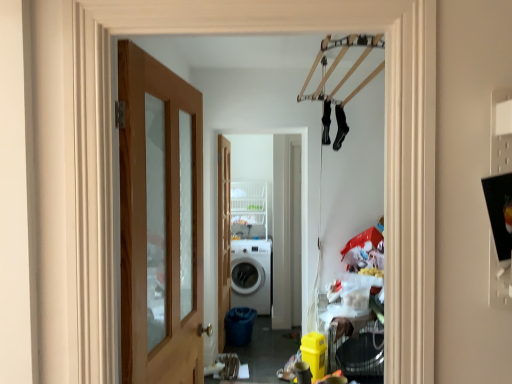
Question: Is white matte washing machine at center in front of wooden door at center, arranged as the 1th door when viewed from the back?

Choices:
 (A) no
 (B) yes

Answer: (A)

Question: Is white matte washing machine at center far from wooden door at center, placed as the 2th door when sorted from front to back?

Choices:
 (A) no
 (B) yes

Answer: (A)

Question: Considering the relative sizes of white matte washing machine at center and wooden door at center, placed as the 2th door when sorted from front to back, in the image provided, is white matte washing machine at center shorter than wooden door at center, placed as the 2th door when sorted from front to back,?

Choices:
 (A) no
 (B) yes

Answer: (B)

Question: From the image's perspective, is white matte washing machine at center below wooden door at center, placed as the 2th door when sorted from front to back?

Choices:
 (A) no
 (B) yes

Answer: (B)

Question: Can you confirm if white matte washing machine at center is positioned to the right of wooden door at center, arranged as the 1th door when viewed from the back?

Choices:
 (A) yes
 (B) no

Answer: (A)

Question: Considering the positions of wooden door at center, placed as the 2th door when sorted from front to back, and white matte washing machine at center in the image, is wooden door at center, placed as the 2th door when sorted from front to back, taller or shorter than white matte washing machine at center?

Choices:
 (A) tall
 (B) short

Answer: (A)

Question: Is wooden door at center, arranged as the 1th door when viewed from the back, wider or thinner than white matte washing machine at center?

Choices:
 (A) wide
 (B) thin

Answer: (B)

Question: Is wooden door at center, arranged as the 1th door when viewed from the back, situated inside white matte washing machine at center or outside?

Choices:
 (A) outside
 (B) inside

Answer: (A)

Question: In terms of size, does wooden door at center, placed as the 2th door when sorted from front to back, appear bigger or smaller than white matte washing machine at center?

Choices:
 (A) big
 (B) small

Answer: (B)

Question: In terms of width, does white glossy washing machine at center look wider or thinner when compared to wooden door at left, which is counted as the first door, starting from the front?

Choices:
 (A) thin
 (B) wide

Answer: (B)

Question: Visually, is white glossy washing machine at center positioned to the left or to the right of wooden door at left, marked as the 2th door in a back-to-front arrangement?

Choices:
 (A) right
 (B) left

Answer: (A)

Question: From the image's perspective, relative to wooden door at left, marked as the 2th door in a back-to-front arrangement, is white glossy washing machine at center above or below?

Choices:
 (A) below
 (B) above

Answer: (A)

Question: Choose the correct answer: Is white glossy washing machine at center inside wooden door at left, marked as the 2th door in a back-to-front arrangement, or outside it?

Choices:
 (A) outside
 (B) inside

Answer: (A)

Question: From a real-world perspective, is white matte washing machine at center physically located above or below wooden door at left, marked as the 2th door in a back-to-front arrangement?

Choices:
 (A) above
 (B) below

Answer: (B)

Question: Does point (236, 276) appear closer or farther from the camera than point (195, 294)?

Choices:
 (A) closer
 (B) farther

Answer: (B)